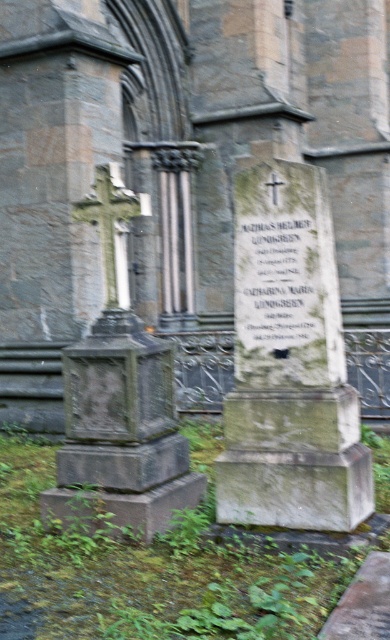
Is point (86, 163) more distant than point (237, 330)?

Yes.

Does stone cross at center have a larger size compared to white stone inscription at center?

Yes, stone cross at center is bigger than white stone inscription at center.

Does point (299, 144) lie behind point (306, 312)?

Yes, it is.

Where is `stone cross at center`? stone cross at center is located at coordinates (182, 172).

Between point (79, 170) and point (159, 419), which one is positioned in front?

Point (159, 419) is more forward.

Can you confirm if stone cross at center is wider than granite cross at left?

Yes, stone cross at center is wider than granite cross at left.

The image size is (390, 640). In order to click on stone cross at center in this screenshot , I will do `click(182, 172)`.

You are a GUI agent. You are given a task and a screenshot of the screen. Output one action in this format:
    pyautogui.click(x=<x>, y=<y>)
    Task: Click on the stone cross at center
    The width and height of the screenshot is (390, 640).
    Given the screenshot: What is the action you would take?
    pyautogui.click(x=182, y=172)

From the picture: Is the position of green stone gravestone at center more distant than that of white stone inscription at center?

That is False.

Who is shorter, green stone gravestone at center or white stone inscription at center?

Standing shorter between the two is white stone inscription at center.

Where is `green stone gravestone at center`? green stone gravestone at center is located at coordinates (288, 364).